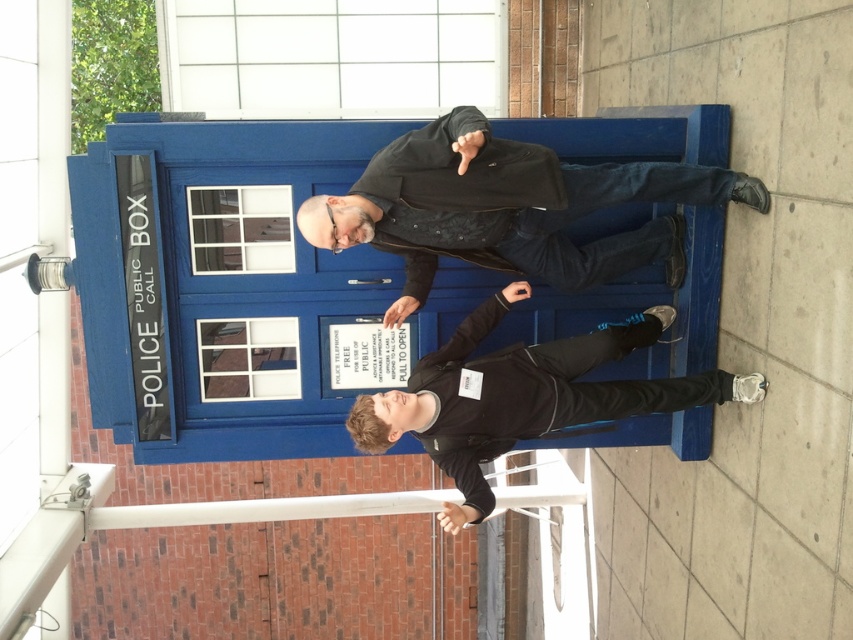
Who is positioned more to the left, matte black jacket at center or black matte jacket at center?

From the viewer's perspective, matte black jacket at center appears more on the left side.

Does matte black jacket at center appear under black matte jacket at center?

Incorrect, matte black jacket at center is not positioned below black matte jacket at center.

In order to click on matte black jacket at center in this screenshot , I will do `click(508, 208)`.